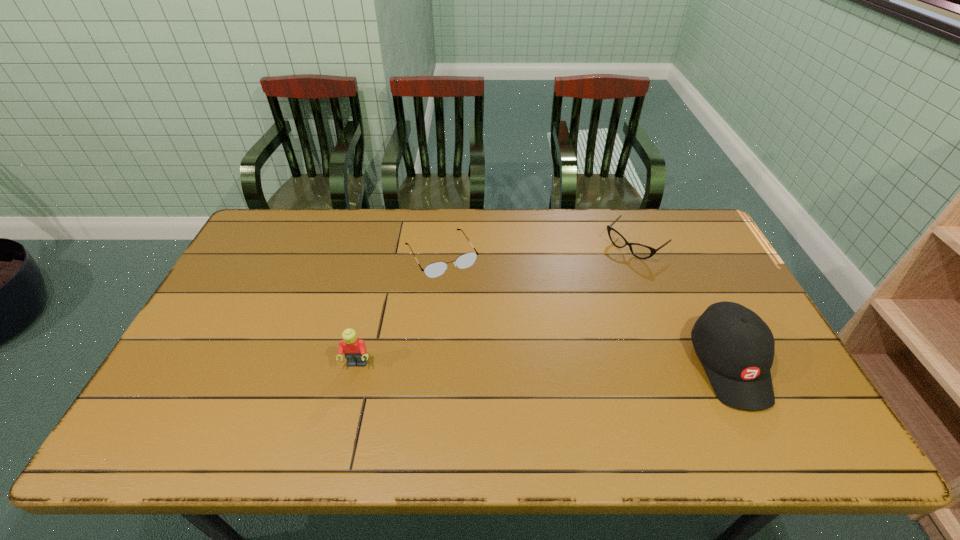
Locate an element on the screen. The height and width of the screenshot is (540, 960). unoccupied area between the baseball cap and the second object from left to right is located at coordinates (586, 310).

Identify the location of vacant space in between the right spectacles and the Lego. [495, 305].

Where is `free area in between the third object from right to left and the leftmost object`? Image resolution: width=960 pixels, height=540 pixels. free area in between the third object from right to left and the leftmost object is located at coordinates (399, 310).

Locate an element on the screen. This screenshot has width=960, height=540. free space that is in between the Lego and the left spectacles is located at coordinates (399, 310).

The width and height of the screenshot is (960, 540). Identify the location of empty location between the baseball cap and the right spectacles. (682, 305).

The width and height of the screenshot is (960, 540). I want to click on free spot between the Lego and the baseball cap, so click(543, 364).

The width and height of the screenshot is (960, 540). Identify the location of vacant space that's between the right spectacles and the Lego. (495, 305).

The width and height of the screenshot is (960, 540). Identify the location of free space that is in between the third object from right to left and the Lego. (399, 310).

The image size is (960, 540). In order to click on free point between the baseball cap and the third object from right to left in this screenshot , I will do `click(586, 310)`.

The height and width of the screenshot is (540, 960). I want to click on object that is the second closest to the baseball cap, so click(436, 269).